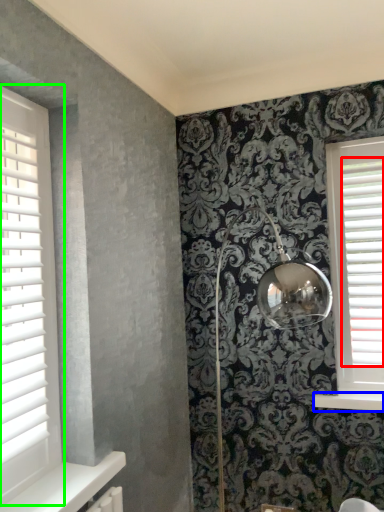
Question: Which is nearer to the blind (highlighted by a red box)? window sill (highlighted by a blue box) or window (highlighted by a green box).

Choices:
 (A) window sill
 (B) window

Answer: (A)